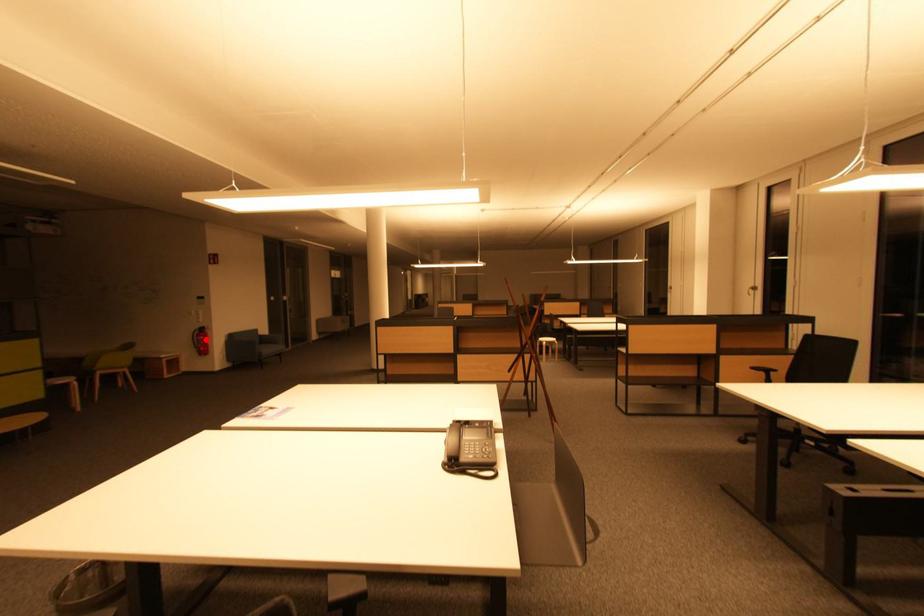
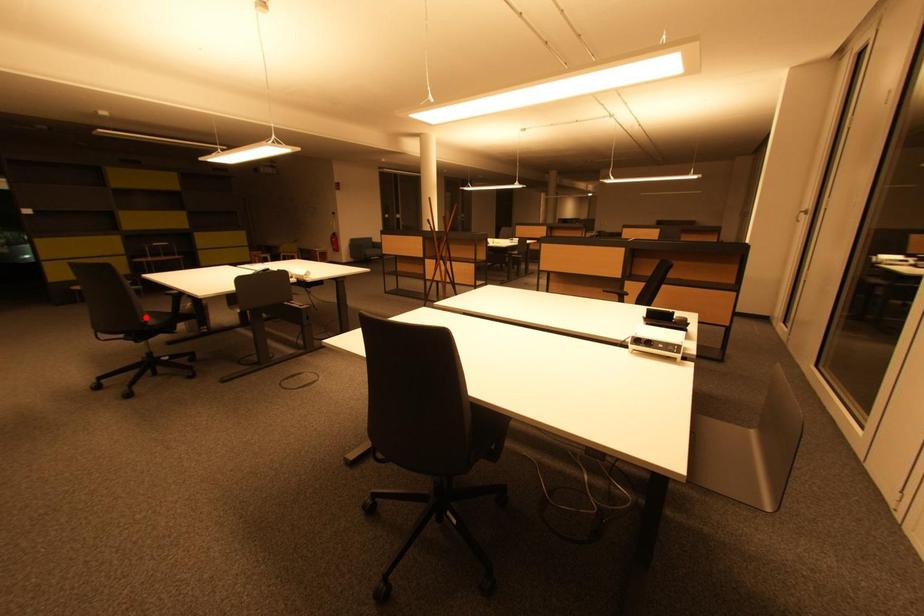
I am providing you with two images of the same scene from different viewpoints. A red point is marked on the first image and another point is marked on the second image. Does the point marked in image1 correspond to the same location as the one in image2?

No